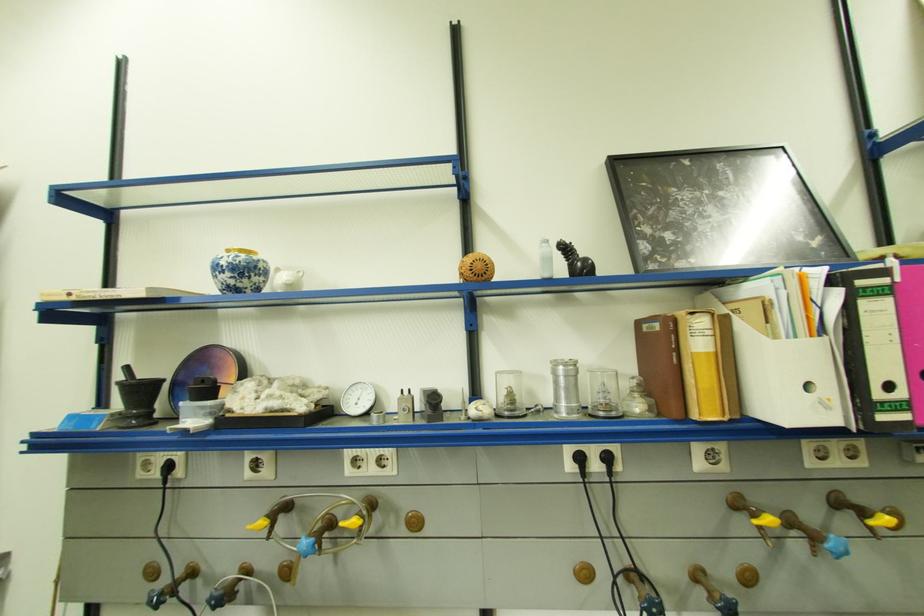
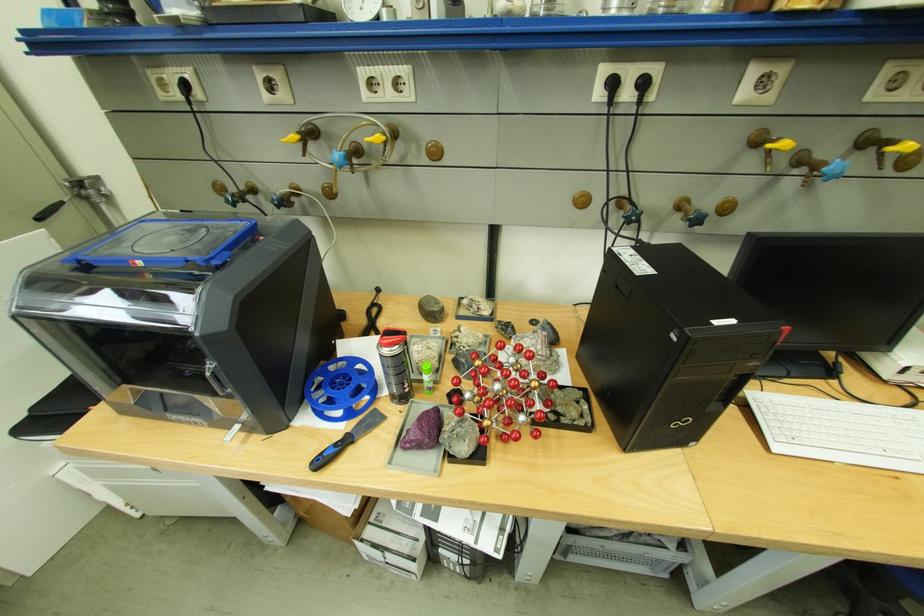
Question: The images are taken continuously from a first-person perspective. In which direction is your viewpoint rotating?

Choices:
 (A) Left
 (B) Right
 (C) Up
 (D) Down

Answer: (D)